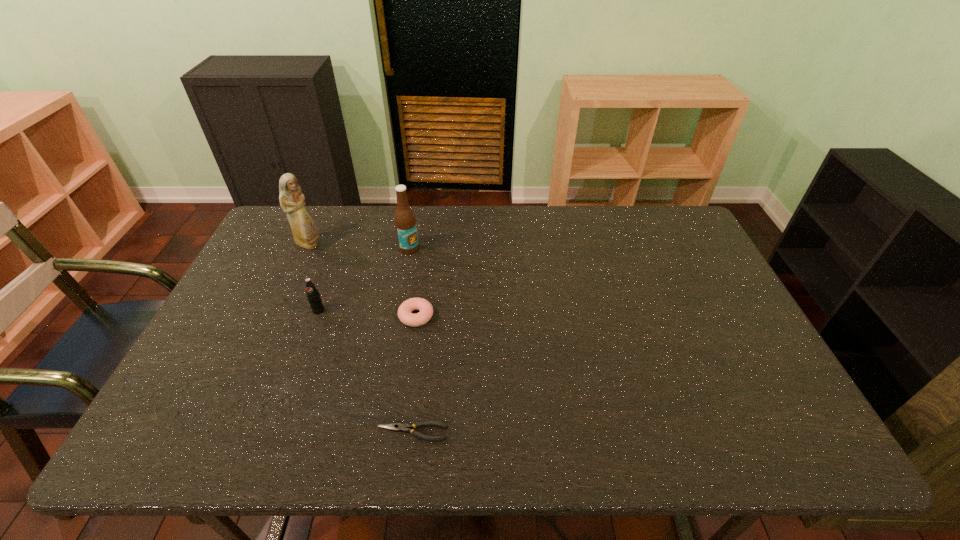
Image resolution: width=960 pixels, height=540 pixels. Identify the location of the leftmost object. (305, 231).

Locate an element on the screen. beer bottle is located at coordinates (405, 223).

Identify the location of pop. (313, 295).

Identify the location of the fourth object from right to left. This screenshot has height=540, width=960. (313, 295).

You are a GUI agent. You are given a task and a screenshot of the screen. Output one action in this format:
    pyautogui.click(x=<x>, y=<y>)
    Task: Click on the doughnut
    The width and height of the screenshot is (960, 540).
    Given the screenshot: What is the action you would take?
    pyautogui.click(x=426, y=310)

The width and height of the screenshot is (960, 540). I want to click on the nearest object, so click(x=397, y=427).

The height and width of the screenshot is (540, 960). In order to click on pliers in this screenshot , I will do 397,427.

Image resolution: width=960 pixels, height=540 pixels. What are the coordinates of `free location located 0.310m on the front-facing side of the figurine` in the screenshot? It's located at (417, 245).

Find the location of `vacant point located on the left of the beer bottle`. vacant point located on the left of the beer bottle is located at coordinates (301, 248).

Where is `vacant space situated on the front label of the pop`? This screenshot has height=540, width=960. vacant space situated on the front label of the pop is located at coordinates (311, 331).